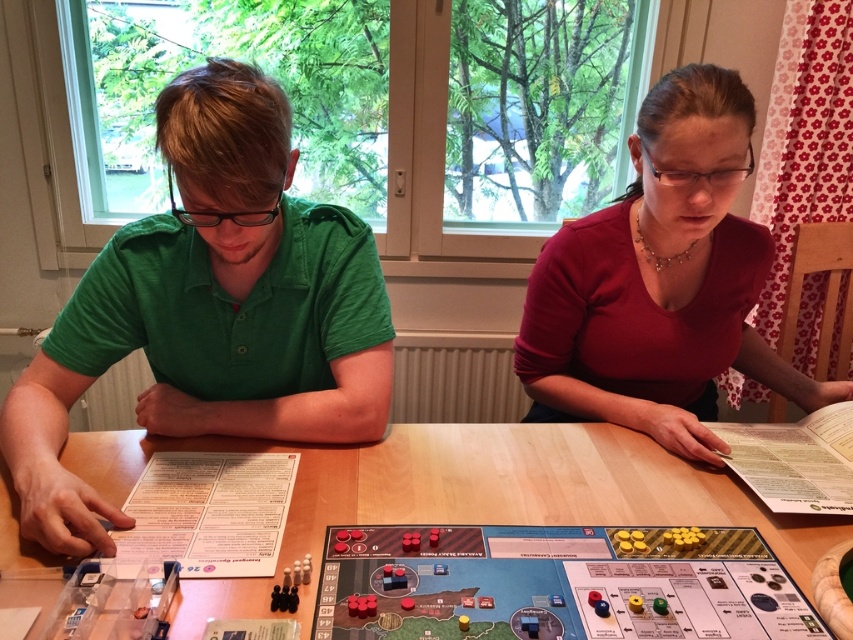
Which is more to the left, matte red shirt at center or wooden table at center?

wooden table at center is more to the left.

This screenshot has width=853, height=640. Identify the location of matte red shirt at center. (660, 282).

Is point (236, 83) closer to camera compared to point (747, 566)?

Yes, point (236, 83) is in front of point (747, 566).

Who is higher up, green cotton shirt at left or wooden board game at center?

green cotton shirt at left

Is point (68, 483) less distant than point (445, 556)?

No, (68, 483) is behind (445, 556).

You are a GUI agent. You are given a task and a screenshot of the screen. Output one action in this format:
    pyautogui.click(x=<x>, y=<y>)
    Task: Click on the green cotton shirt at left
    The width and height of the screenshot is (853, 640).
    Given the screenshot: What is the action you would take?
    pyautogui.click(x=212, y=308)

Between point (171, 428) and point (447, 522), which one is positioned in front?

Point (447, 522) is in front.

Which is behind, point (354, 220) or point (444, 496)?

The point (354, 220) is behind.

Measure the distance between point [215,401] and camera.

1.15 meters

You are a GUI agent. You are given a task and a screenshot of the screen. Output one action in this format:
    pyautogui.click(x=<x>, y=<y>)
    Task: Click on the green cotton shirt at left
    The width and height of the screenshot is (853, 640).
    Given the screenshot: What is the action you would take?
    pyautogui.click(x=212, y=308)